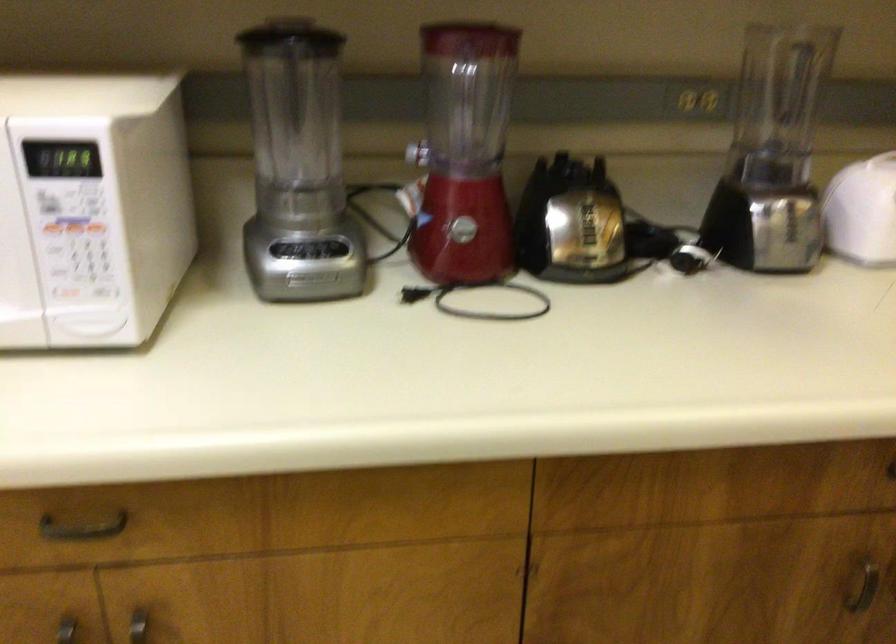
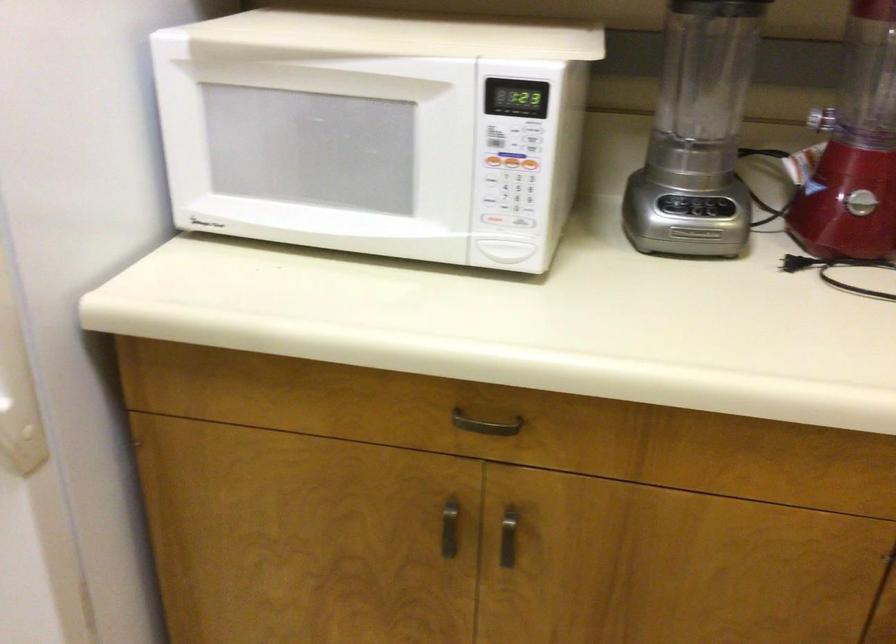
Question: The camera is either moving clockwise (left) or counter-clockwise (right) around the object. The first image is from the beginning of the video and the second image is from the end. Is the camera moving left or right when shooting the video?

Choices:
 (A) Left
 (B) Right

Answer: (B)